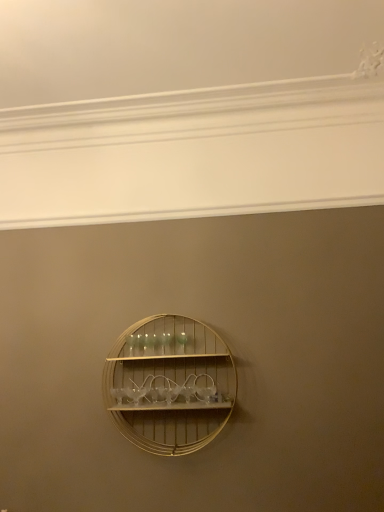
What is the approximate width of gold wire shelf at center?

gold wire shelf at center is 7.28 inches wide.

What do you see at coordinates (170, 384) in the screenshot?
I see `gold wire shelf at center` at bounding box center [170, 384].

This screenshot has width=384, height=512. Identify the location of gold wire shelf at center. (170, 384).

Looking at this image, in order to face gold wire shelf at center, should I rotate leftwards or rightwards?

To face it directly, rotate left by 2.417 degrees.

Find the location of a particular element. The width and height of the screenshot is (384, 512). gold wire shelf at center is located at coordinates (170, 384).